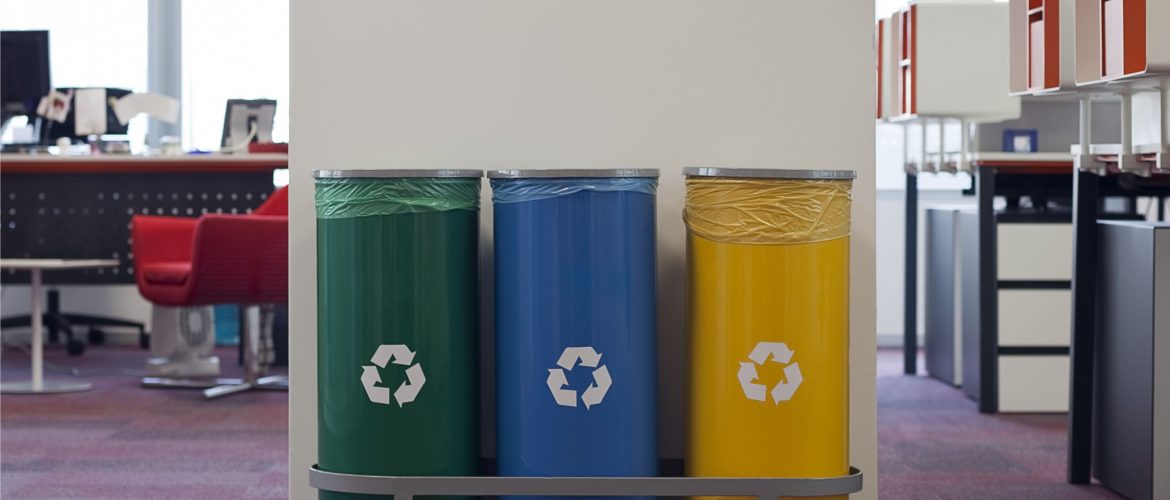
The height and width of the screenshot is (500, 1170). I want to click on brown hardwood floor, so click(143, 446).